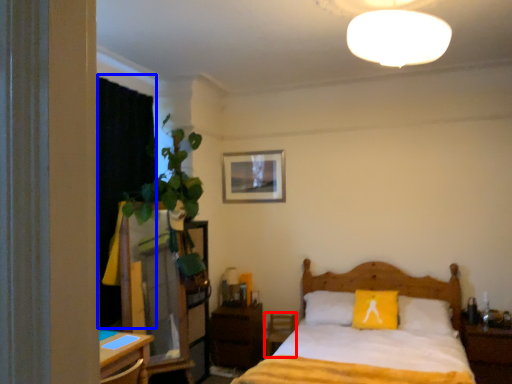
Question: Which of the following is the farthest to the observer, armchair (highlighted by a red box) or curtain (highlighted by a blue box)?

Choices:
 (A) armchair
 (B) curtain

Answer: (A)